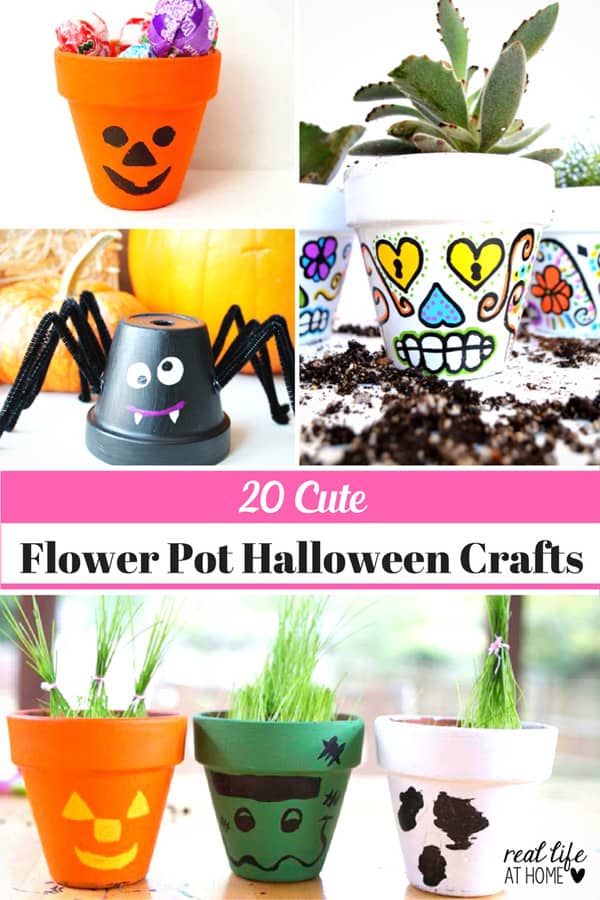
The image size is (600, 900). Identify the location of planter. click(136, 117).